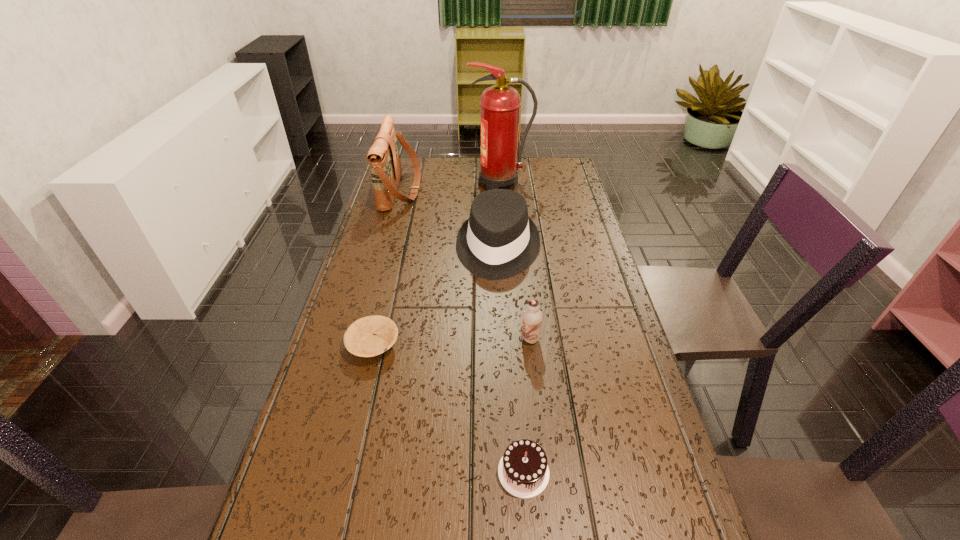
You are a GUI agent. You are given a task and a screenshot of the screen. Output one action in this format:
    pyautogui.click(x=<x>, y=<y>)
    Task: Click on the tallest object
    This screenshot has height=540, width=960.
    Given the screenshot: What is the action you would take?
    pyautogui.click(x=500, y=104)

At what (x,y) coordinates should I click in order to perform the action: click on shoulder bag. Please return your answer as a coordinate pair (x, y). Image resolution: width=960 pixels, height=540 pixels. Looking at the image, I should click on [x=384, y=158].

Find the location of a particular element. fedora is located at coordinates (498, 241).

Where is `the third farthest object`? This screenshot has height=540, width=960. the third farthest object is located at coordinates (498, 241).

I want to click on chocolate milk, so click(532, 317).

Where is `the nearest object`? The width and height of the screenshot is (960, 540). the nearest object is located at coordinates (523, 471).

Image resolution: width=960 pixels, height=540 pixels. Find the location of `the fifth tallest object`. the fifth tallest object is located at coordinates (523, 471).

The image size is (960, 540). In order to click on the shortest object in this screenshot , I will do `click(369, 336)`.

At what (x,y) coordinates should I click in order to perform the action: click on free space located 0.110m on the front-facing side of the tallest object. Please return your answer as a coordinate pair (x, y). Image resolution: width=960 pixels, height=540 pixels. Looking at the image, I should click on (440, 184).

Where is `free space located on the front-facing side of the tallest object`? free space located on the front-facing side of the tallest object is located at coordinates (394, 184).